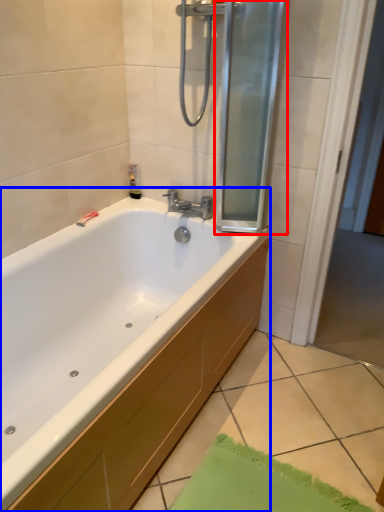
Question: Which object is further to the camera taking this photo, screen door (highlighted by a red box) or bathtub (highlighted by a blue box)?

Choices:
 (A) screen door
 (B) bathtub

Answer: (A)